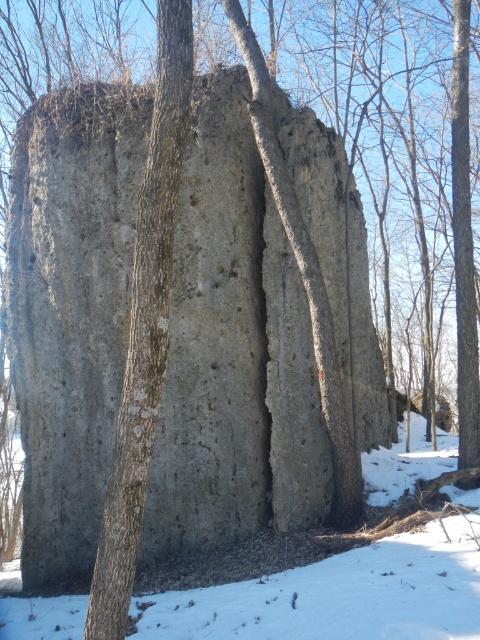
You are standing in the wintry forest and see the gray rough rock at center. There is a point marked at coordinates (232, 352). Where is this point located?

The point marked at coordinates (232, 352) is located on the gray rough rock at center.

You are an explorer in the winter forest. You see the white powdery snow at lower center and the smooth gray bark at center. Which object is located to the right of the other?

The white powdery snow at lower center is to the right of the smooth gray bark at center.

You are an explorer navigating through the wintry forest and come across the large rock formation. You notice two points marked on the rock surface at coordinates point (72, 413) and point (130, 384). Which point is closer to you as you stand in front of the rock formation?

Point (130, 384) is closer to you because point (72, 413) is behind it.